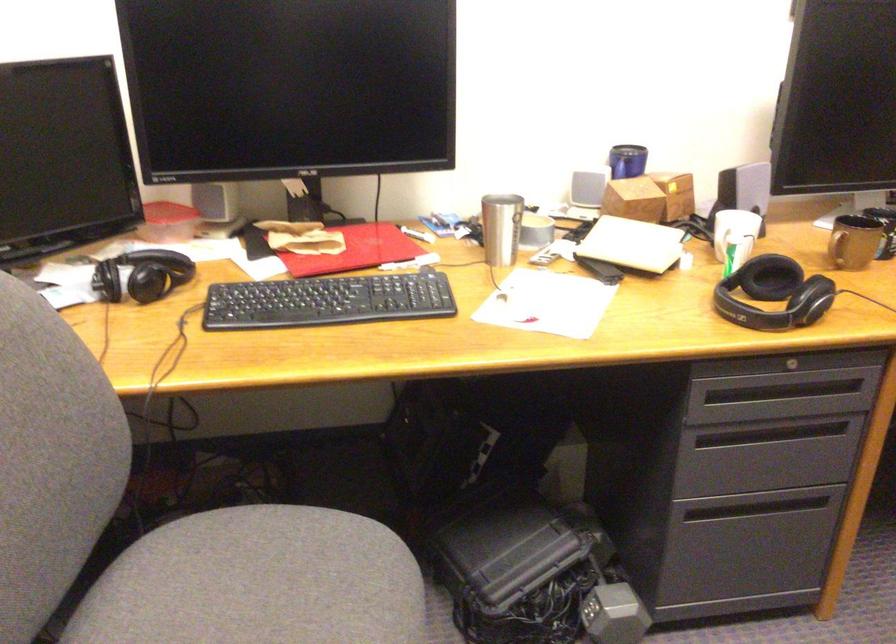
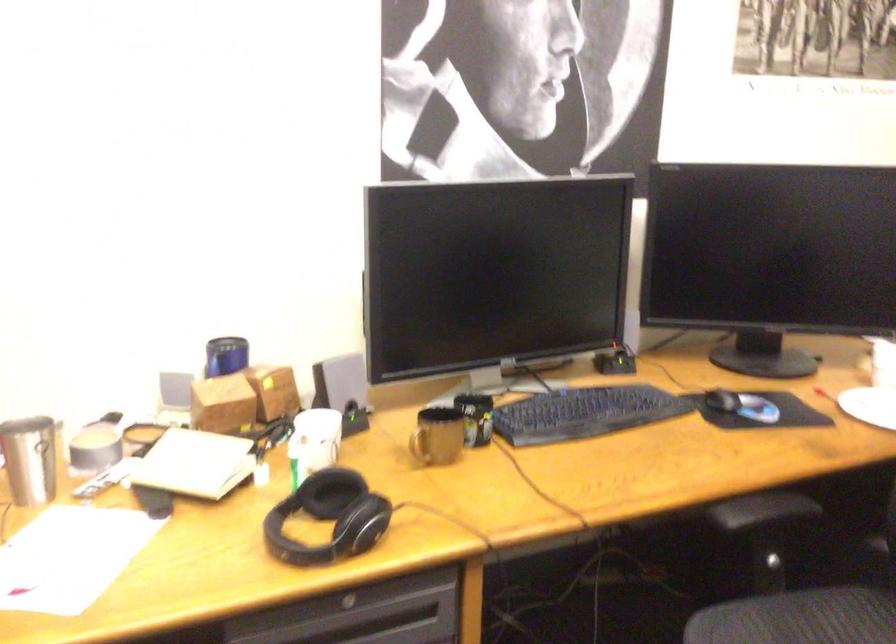
In the second image, find the point that corresponds to point 760,290 in the first image.

(329, 518)